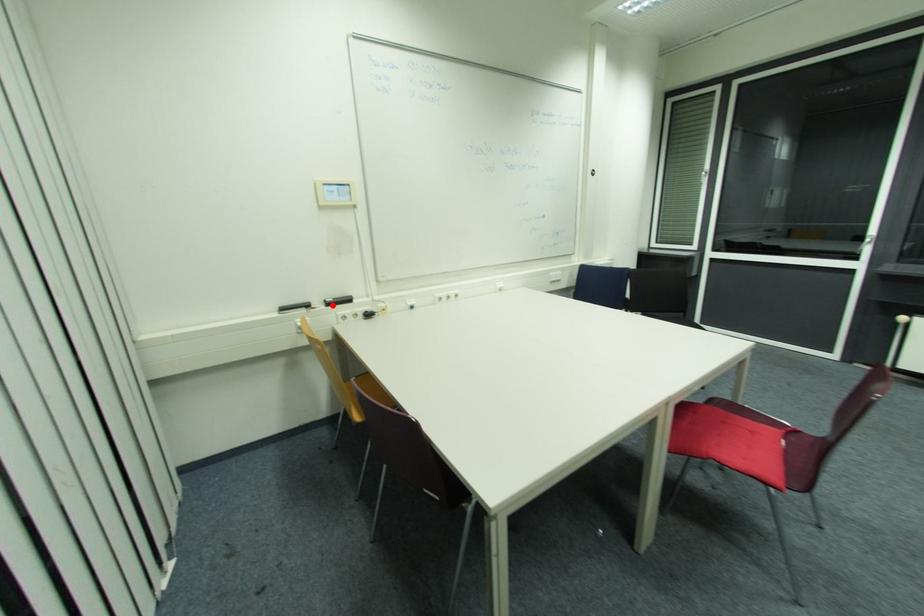
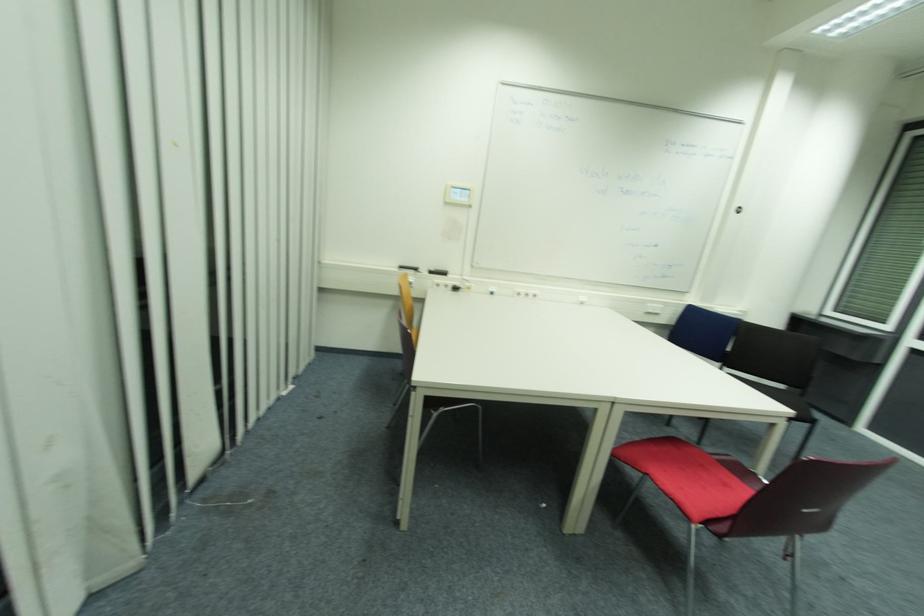
Locate, in the second image, the point that corresponds to the highlighted location in the first image.

(433, 273)